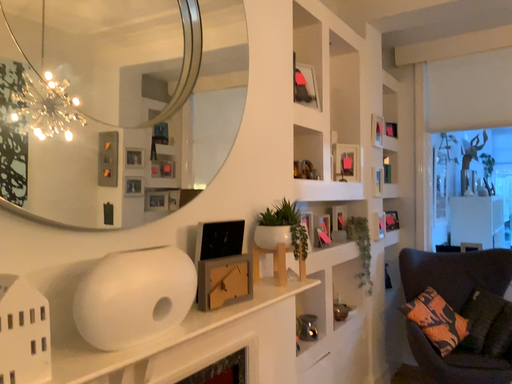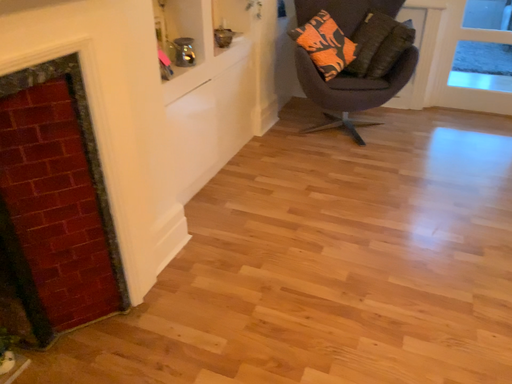
Question: Which way did the camera rotate in the video?

Choices:
 (A) rotated downward
 (B) rotated upward

Answer: (A)